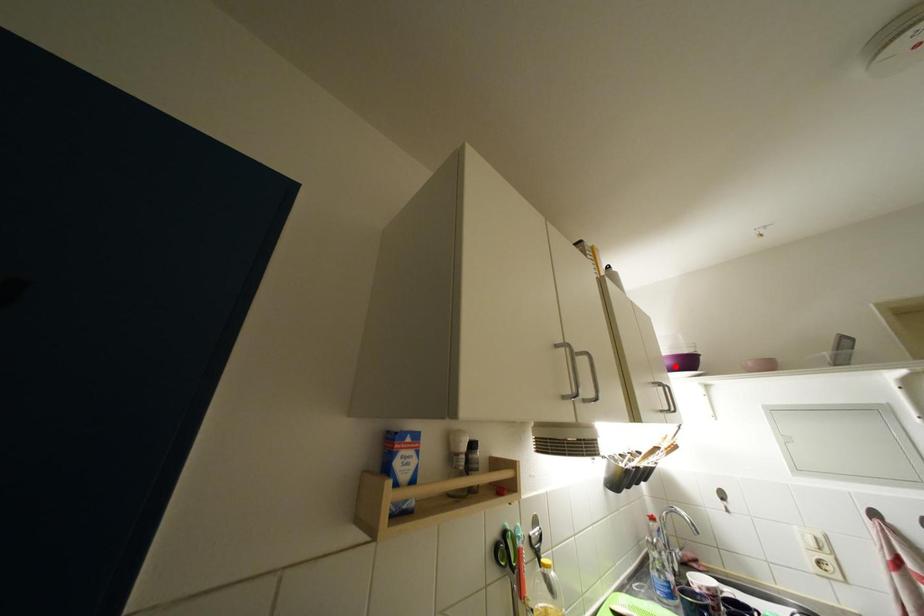
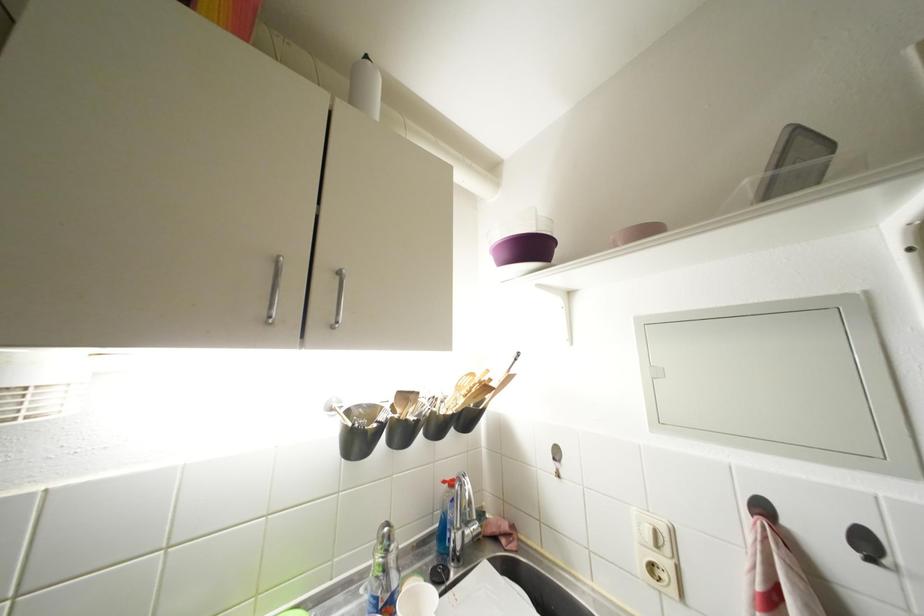
In the second image, find the point that corresponds to the highlighted location in the first image.

(512, 259)